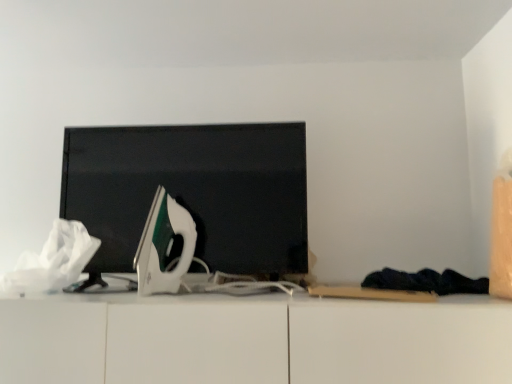
The image size is (512, 384). What do you see at coordinates (193, 192) in the screenshot? I see `black glossy computer monitor at center` at bounding box center [193, 192].

Find the location of a particular element. black glossy computer monitor at center is located at coordinates (193, 192).

Where is `black glossy computer monitor at center`? This screenshot has height=384, width=512. black glossy computer monitor at center is located at coordinates (193, 192).